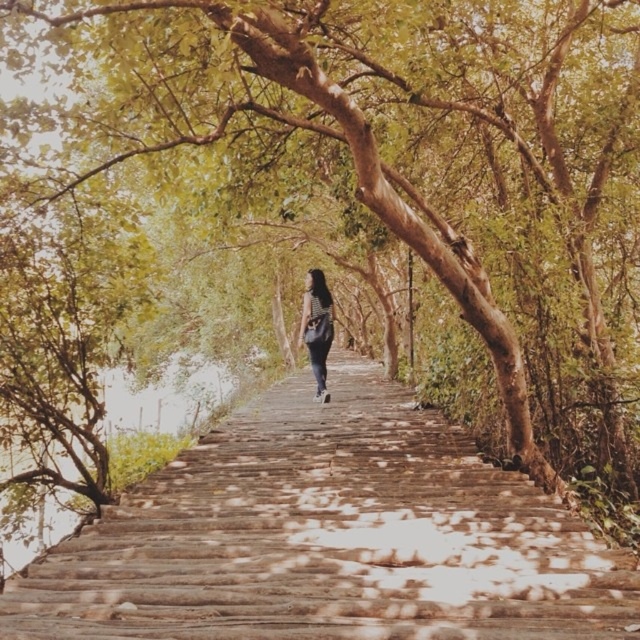
Does wooden stairs at center have a larger size compared to striped fabric bag at center?

No.

Does point (474, 493) lie behind point (301, 337)?

No, (474, 493) is closer to viewer.

Between point (477, 465) and point (323, 353), which one is positioned in front?

Positioned in front is point (477, 465).

You are a GUI agent. You are given a task and a screenshot of the screen. Output one action in this format:
    pyautogui.click(x=<x>, y=<y>)
    Task: Click on the wooden stairs at center
    
    Given the screenshot: What is the action you would take?
    pyautogui.click(x=330, y=538)